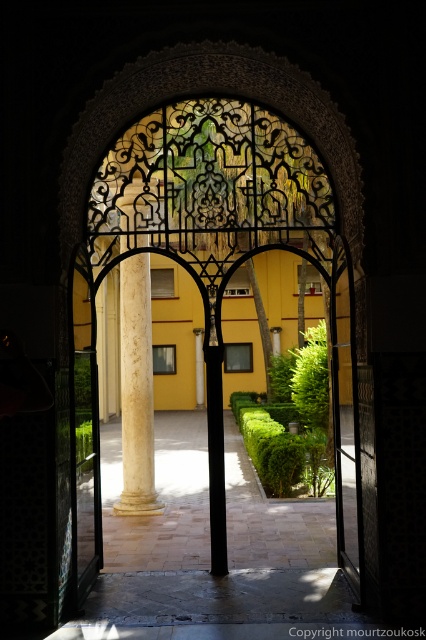
Question: Which point is farther to the camera?

Choices:
 (A) paved stone path at center
 (B) white marble column at center
 (C) black glass door at center
 (D) matte black pillar at center

Answer: (D)

Question: Does black glass door at center have a greater width compared to matte black pillar at center?

Choices:
 (A) yes
 (B) no

Answer: (B)

Question: Is paved stone path at center further to camera compared to white marble column at center?

Choices:
 (A) yes
 (B) no

Answer: (A)

Question: Which of these objects is positioned farthest from the black glass door at center?

Choices:
 (A) matte black pillar at center
 (B) white marble column at center

Answer: (A)

Question: Can you confirm if white marble column at center is positioned below matte black pillar at center?

Choices:
 (A) no
 (B) yes

Answer: (B)

Question: Which object appears farthest from the camera in this image?

Choices:
 (A) matte black pillar at center
 (B) paved stone path at center
 (C) black metal gate at center

Answer: (A)